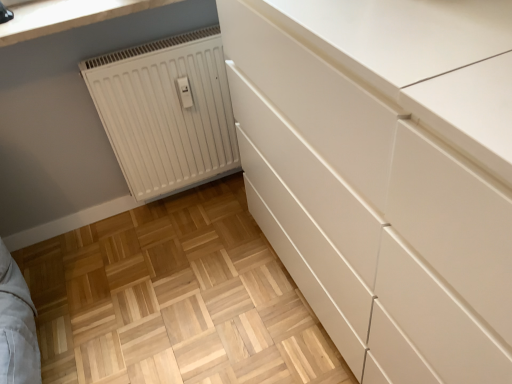
Question: In the image, is white matte radiator at lower left positioned in front of or behind white smooth countertop at upper left?

Choices:
 (A) front
 (B) behind

Answer: (B)

Question: From the image's perspective, is white matte radiator at lower left positioned above or below white smooth countertop at upper left?

Choices:
 (A) below
 (B) above

Answer: (A)

Question: From a real-world perspective, is white matte radiator at lower left positioned above or below white smooth countertop at upper left?

Choices:
 (A) below
 (B) above

Answer: (A)

Question: Relative to white matte radiator at lower left, is white smooth countertop at upper left in front or behind?

Choices:
 (A) behind
 (B) front

Answer: (B)

Question: Based on their positions, is white smooth countertop at upper left located to the left or right of white matte radiator at lower left?

Choices:
 (A) left
 (B) right

Answer: (A)

Question: Considering the positions of white smooth countertop at upper left and white matte radiator at lower left in the image, is white smooth countertop at upper left wider or thinner than white matte radiator at lower left?

Choices:
 (A) wide
 (B) thin

Answer: (A)

Question: Considering the positions of point (49, 13) and point (110, 114), is point (49, 13) closer or farther from the camera than point (110, 114)?

Choices:
 (A) closer
 (B) farther

Answer: (A)